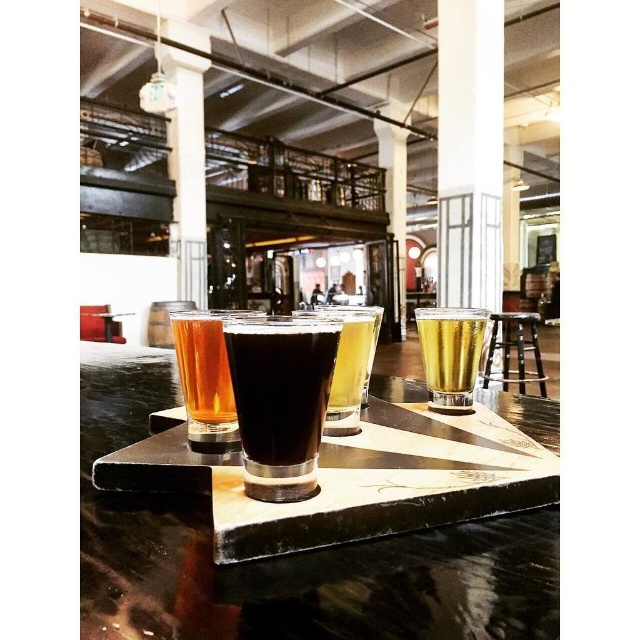
Does black marble tray at center have a lesser width compared to black leather stool at right?

No, black marble tray at center is not thinner than black leather stool at right.

Is point (548, 604) positioned after point (524, 388)?

No, (548, 604) is closer to viewer.

You are a GUI agent. You are given a task and a screenshot of the screen. Output one action in this format:
    pyautogui.click(x=<x>, y=<y>)
    Task: Click on the black marble tray at center
    
    Given the screenshot: What is the action you would take?
    pyautogui.click(x=285, y=557)

Between point (346, 592) and point (285, 381), which one is positioned behind?

Positioned behind is point (285, 381).

Between black marble tray at center and dark glass at center, which one appears on the left side from the viewer's perspective?

black marble tray at center

Which is behind, point (198, 524) or point (241, 381)?

Point (198, 524)

At what (x,y) coordinates should I click in order to perform the action: click on black marble tray at center. Please return your answer as a coordinate pair (x, y). The image size is (640, 640). Looking at the image, I should click on (285, 557).

Which is behind, point (470, 573) or point (468, 324)?

Positioned behind is point (468, 324).

Where is `black marble tray at center`? black marble tray at center is located at coordinates (285, 557).